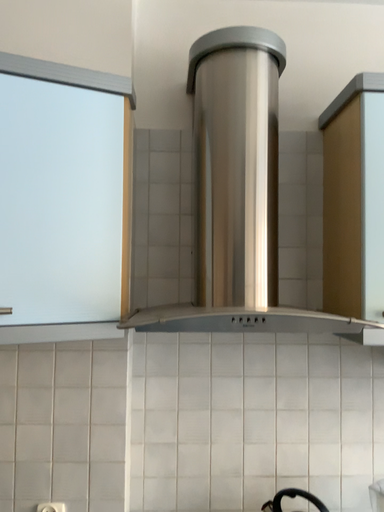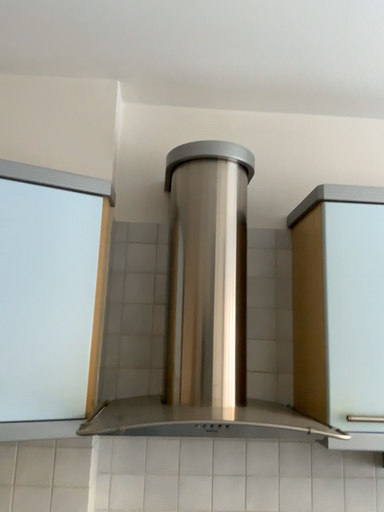
Question: Which way did the camera rotate in the video?

Choices:
 (A) rotated downward
 (B) rotated upward

Answer: (B)